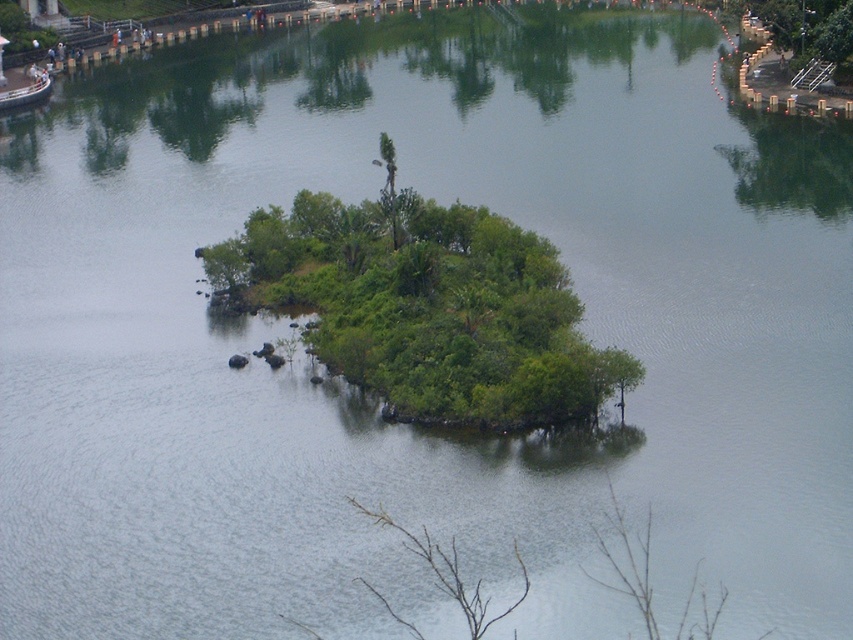
You are standing in a boat looking at the island. There are two points marked on the island. The first point is at coordinate point (233, 307) and the second point is at coordinate point (20, 88). Which point is closer to you?

Point (233, 307) is closer to the camera than point (20, 88), so the first point is closer to you.

You are standing on the island and want to take a boat to the mainland. The metallic silver boat at upper left is your only option. Is the boat positioned to the left or right of the green leafy tree at center?

The metallic silver boat at upper left is positioned to the left of the green leafy tree at center.